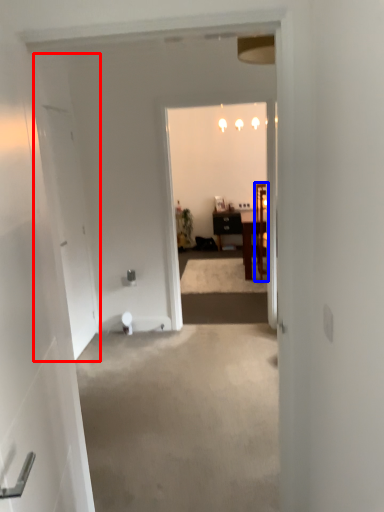
Question: Which of the following is the farthest to the observer, door (highlighted by a red box) or chair (highlighted by a blue box)?

Choices:
 (A) door
 (B) chair

Answer: (B)